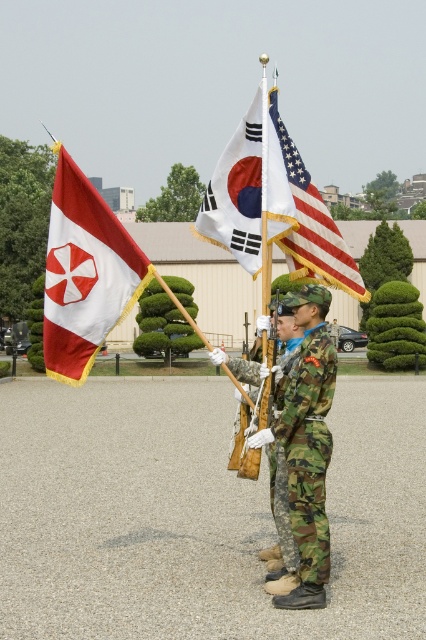
You are a photographer at the ceremony and want to ensure both the white fabric flag at center and the american flag at center are fully visible in your shot. Which flag requires a wider framing to capture its full width?

The white fabric flag at center requires a wider framing because its width is larger than the american flag at center.

You are a photographer at the ceremony. The white matte flag at left is at point 0.428, 0.200. Where should you stand to capture the flag at the correct position in the photo?

To capture the white matte flag at left at the correct position, you should position yourself so that the flag is centered at coordinates 0.428 on the horizontal axis and 0.200 on the vertical axis.

You are a photographer at the ceremony and need to capture a shot that includes both the white matte flag at left and the american flag at center. Based on their positions, which flag should you position on the left side of your photo to ensure both are in frame?

The white matte flag at left is to the left of the american flag at center, so you should position the white matte flag at left on the left side of your photo to ensure both are in frame.